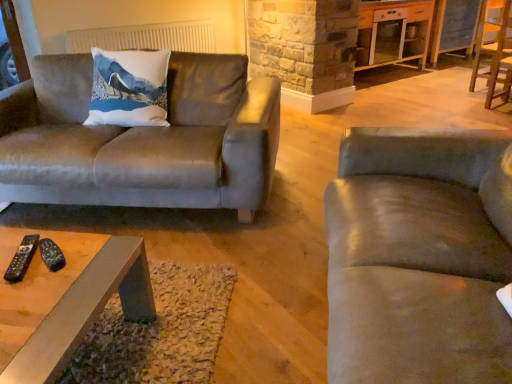
Question: Is black plastic remote at lower left, positioned as the second remote in right-to-left order, positioned before metallic gray coffee table at center?

Choices:
 (A) no
 (B) yes

Answer: (B)

Question: Does black plastic remote at lower left, the first remote when ordered from left to right, turn towards metallic gray coffee table at center?

Choices:
 (A) no
 (B) yes

Answer: (A)

Question: Could metallic gray coffee table at center be considered to be inside black plastic remote at lower left, positioned as the second remote in right-to-left order?

Choices:
 (A) no
 (B) yes

Answer: (A)

Question: Is black plastic remote at lower left, positioned as the second remote in right-to-left order, taller than metallic gray coffee table at center?

Choices:
 (A) no
 (B) yes

Answer: (A)

Question: Would you say black plastic remote at lower left, positioned as the second remote in right-to-left order, is outside metallic gray coffee table at center?

Choices:
 (A) no
 (B) yes

Answer: (B)

Question: From a real-world perspective, is wooden chair at right physically located above or below white glossy cabinet at upper right?

Choices:
 (A) below
 (B) above

Answer: (B)

Question: Is wooden chair at right bigger or smaller than white glossy cabinet at upper right?

Choices:
 (A) big
 (B) small

Answer: (B)

Question: Do you think wooden chair at right is within white glossy cabinet at upper right, or outside of it?

Choices:
 (A) inside
 (B) outside

Answer: (B)

Question: From the image's perspective, is wooden chair at right positioned above or below white glossy cabinet at upper right?

Choices:
 (A) above
 (B) below

Answer: (B)

Question: From a real-world perspective, relative to white glossy cabinet at upper right, is suede couch at left, the second studio couch when ordered from front to back, vertically above or below?

Choices:
 (A) below
 (B) above

Answer: (A)

Question: Is suede couch at left, which appears as the 1th studio couch when viewed from the left, to the left or to the right of white glossy cabinet at upper right in the image?

Choices:
 (A) right
 (B) left

Answer: (B)

Question: From the image's perspective, is suede couch at left, the second studio couch when ordered from front to back, positioned above or below white glossy cabinet at upper right?

Choices:
 (A) above
 (B) below

Answer: (B)

Question: Is suede couch at left, which appears as the 2th studio couch when viewed from the right, in front of or behind white glossy cabinet at upper right in the image?

Choices:
 (A) front
 (B) behind

Answer: (A)

Question: Considering the positions of white fabric radiator at upper center and black plastic remote at lower left, positioned as the second remote in right-to-left order, in the image, is white fabric radiator at upper center wider or thinner than black plastic remote at lower left, positioned as the second remote in right-to-left order,?

Choices:
 (A) wide
 (B) thin

Answer: (B)

Question: Would you say white fabric radiator at upper center is to the left or to the right of black plastic remote at lower left, positioned as the second remote in right-to-left order, in the picture?

Choices:
 (A) right
 (B) left

Answer: (B)